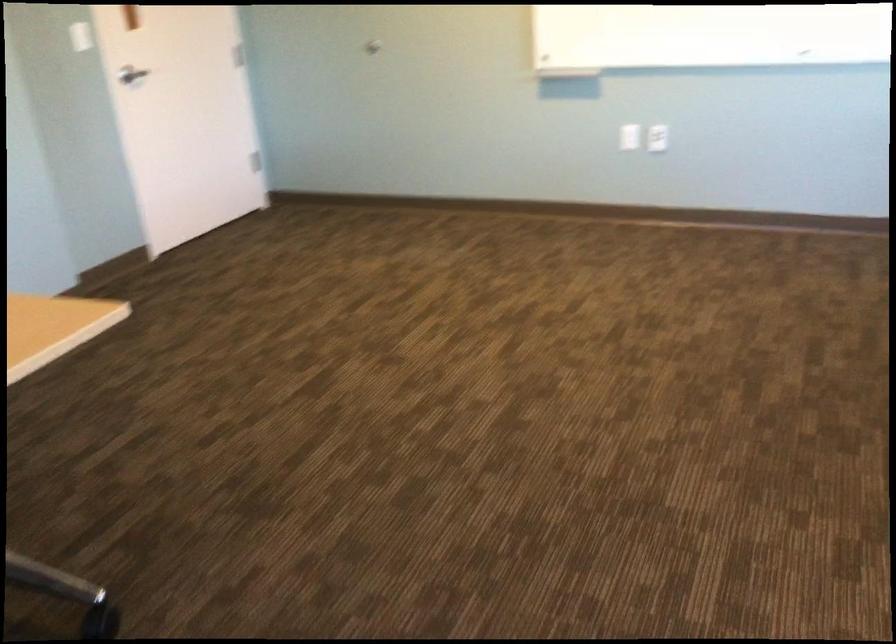
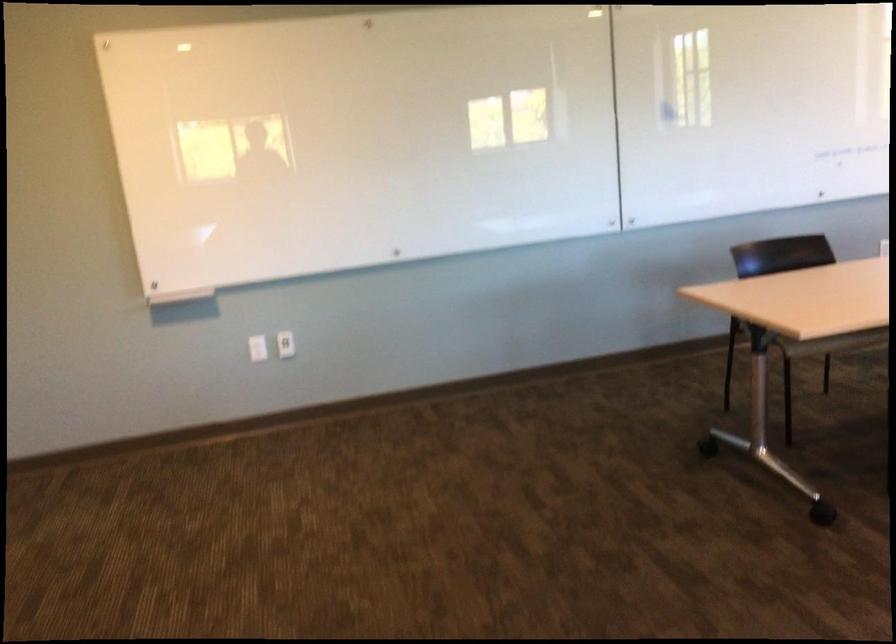
Find the pixel in the second image that matches the point at 657,134 in the first image.

(286, 344)